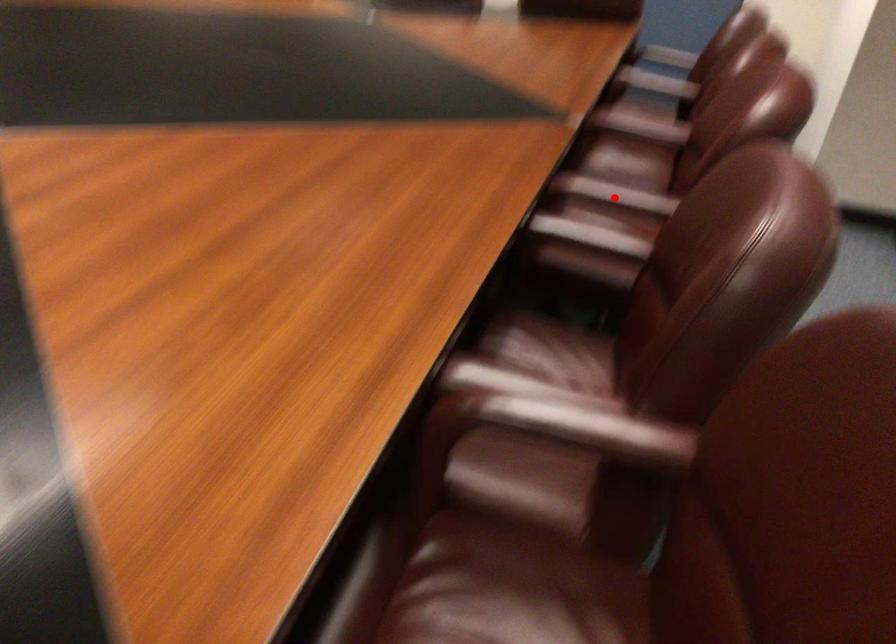
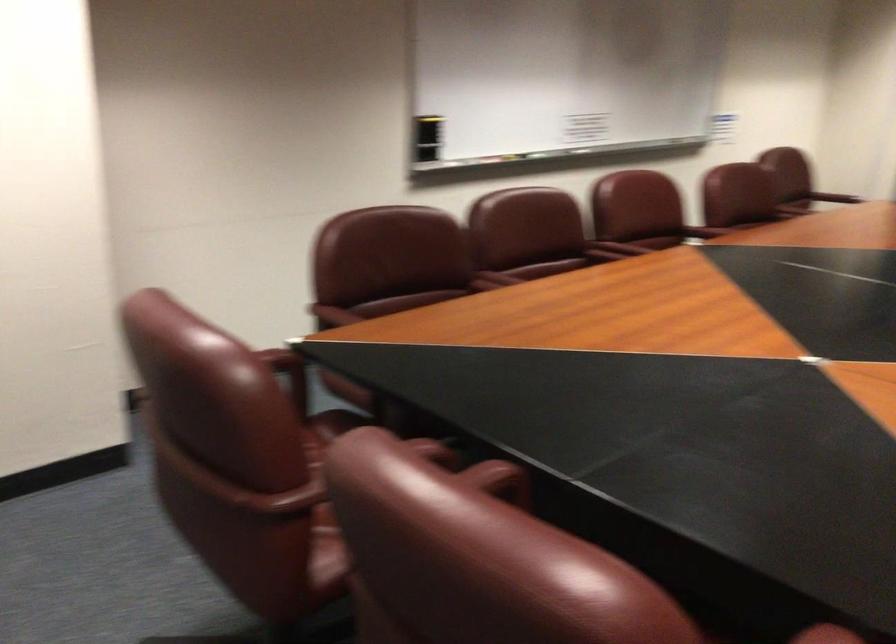
Question: I am providing you with two images of the same scene from different viewpoints. Given a red point in image1, look at the same physical point in image2. Is it:

Choices:
 (A) Closer to the viewpoint
 (B) Farther from the viewpoint

Answer: (B)